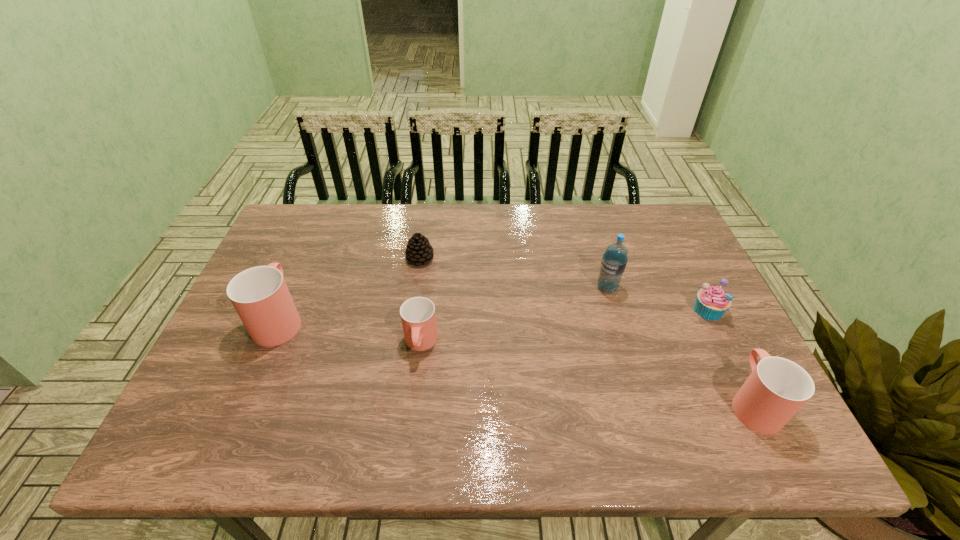
Image resolution: width=960 pixels, height=540 pixels. In order to click on the leftmost object in this screenshot , I will do `click(260, 296)`.

Find the location of `the leftmost cup`. the leftmost cup is located at coordinates (260, 296).

Find the location of a particular element. Image resolution: width=960 pixels, height=540 pixels. the shortest cup is located at coordinates (418, 317).

I want to click on the nearest object, so click(x=777, y=388).

Locate an element on the screen. The height and width of the screenshot is (540, 960). the rightmost cup is located at coordinates (777, 388).

This screenshot has height=540, width=960. What are the coordinates of `the third object from right to left` in the screenshot? It's located at (614, 260).

In order to click on muffin in this screenshot , I will do `click(711, 303)`.

Identify the location of pinecone. The height and width of the screenshot is (540, 960). (418, 251).

Identify the location of blank space located 0.070m on the side of the tallest cup with the handle. (298, 276).

Where is `free spot located 0.130m on the side of the tallest cup with the handle`? free spot located 0.130m on the side of the tallest cup with the handle is located at coordinates (304, 262).